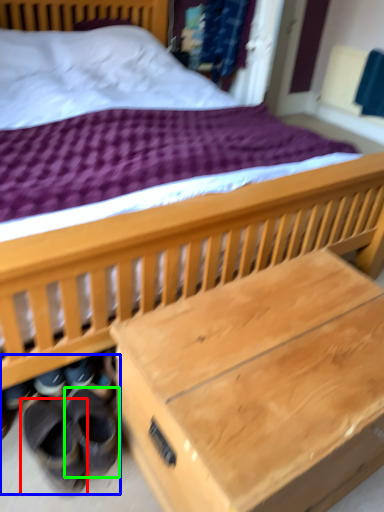
Question: Which object is the farthest from footwear (highlighted by a red box)? Choose among these: shoe (highlighted by a blue box) or footwear (highlighted by a green box).

Choices:
 (A) shoe
 (B) footwear

Answer: (B)